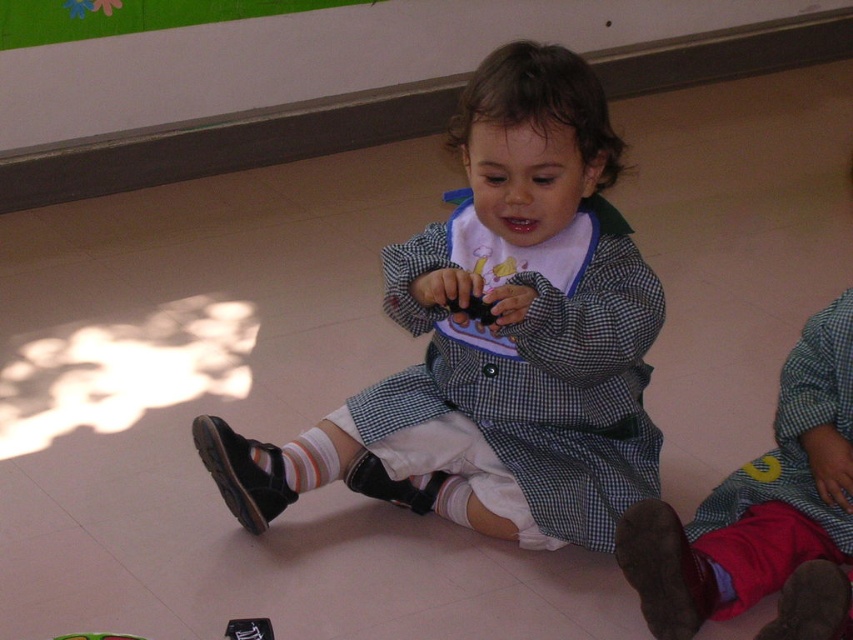
You are a robot navigating the room and need to move from the point at coordinates (506,221) to the point at coordinates (839,547). Based on the scene description, will you have to go around any obstacles between these two points?

The point at coordinates (506,221) is in front of the point at coordinates (839,547). This means the path between them is unobstructed, so you can move directly without needing to go around any obstacles.

You are a tailor trying to determine the appropriate storage space for the checkered fabric coat at center and the red velvet pants at lower right. Based on their heights, which one requires a taller hanger?

The checkered fabric coat at center requires a taller hanger since it has a greater height compared to the red velvet pants at lower right.